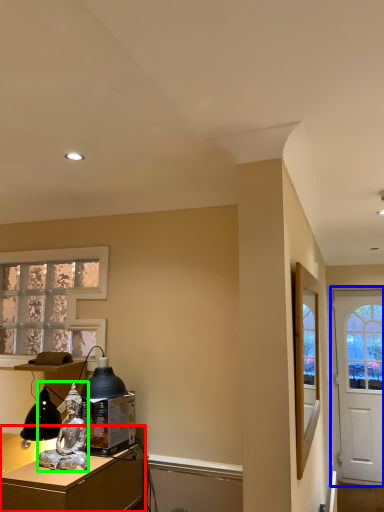
Question: Based on their relative distances, which object is farther from desk (highlighted by a red box)? Choose from door (highlighted by a blue box) and person (highlighted by a green box).

Choices:
 (A) door
 (B) person

Answer: (A)